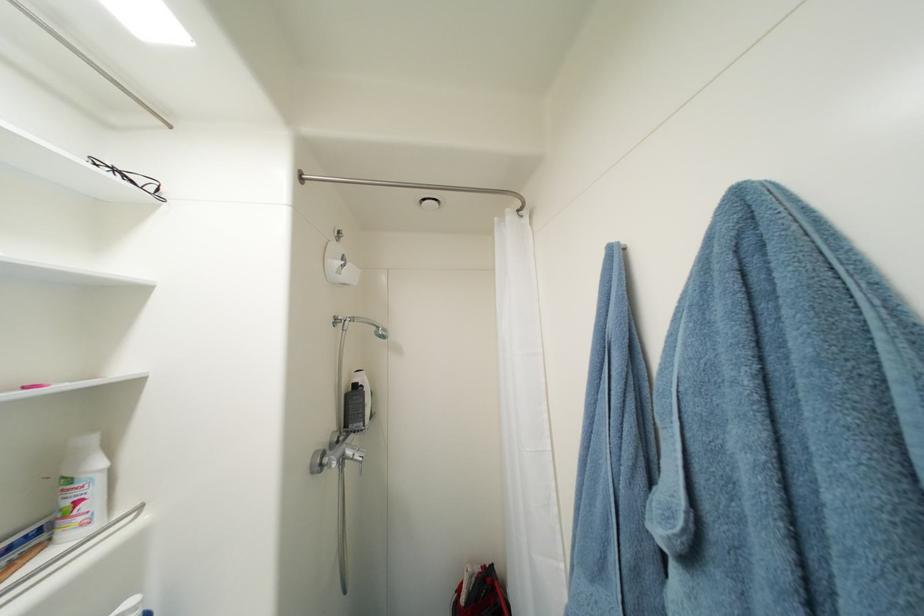
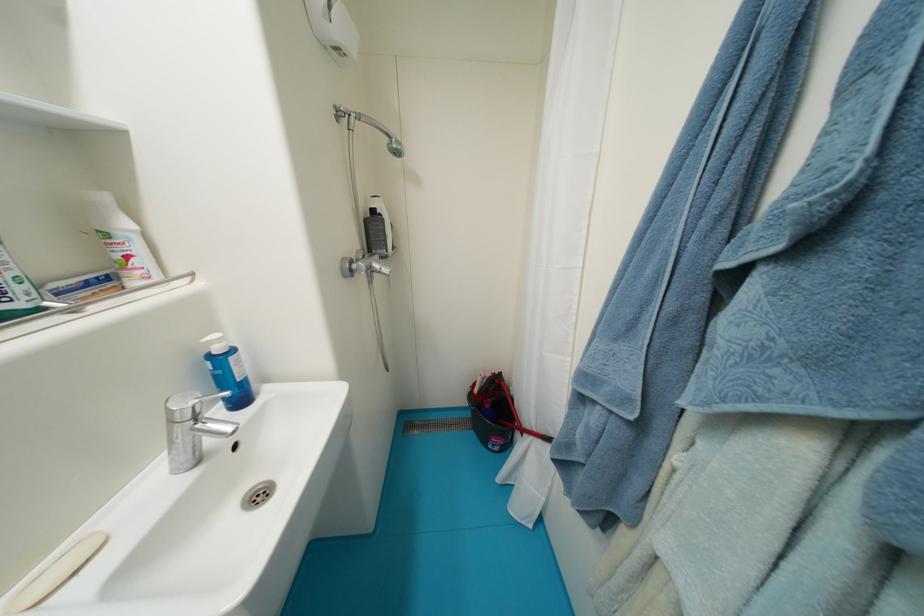
Question: The first image is from the beginning of the video and the second image is from the end. How did the camera likely rotate when shooting the video?

Choices:
 (A) Left
 (B) Right
 (C) Up
 (D) Down

Answer: (D)